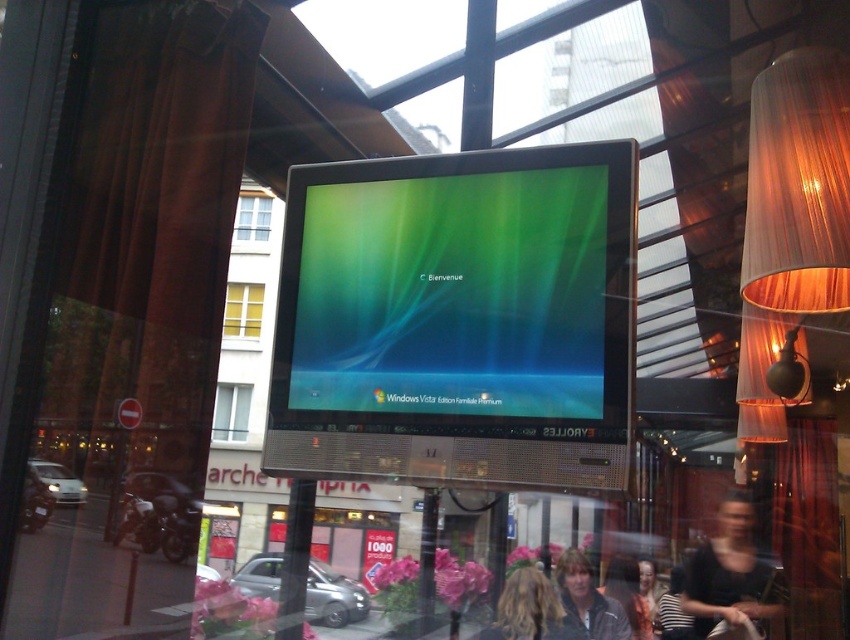
You are a photographer trying to capture a clear shot of the blonde hair at center and the matte black jacket at lower center. Which object should you focus on first to ensure both are in focus?

The blonde hair at center is above the matte black jacket at lower center, so you should focus on the matte black jacket at lower center first since it is closer to the camera. This way, both objects will be in focus as the depth of field will cover the distance between them.